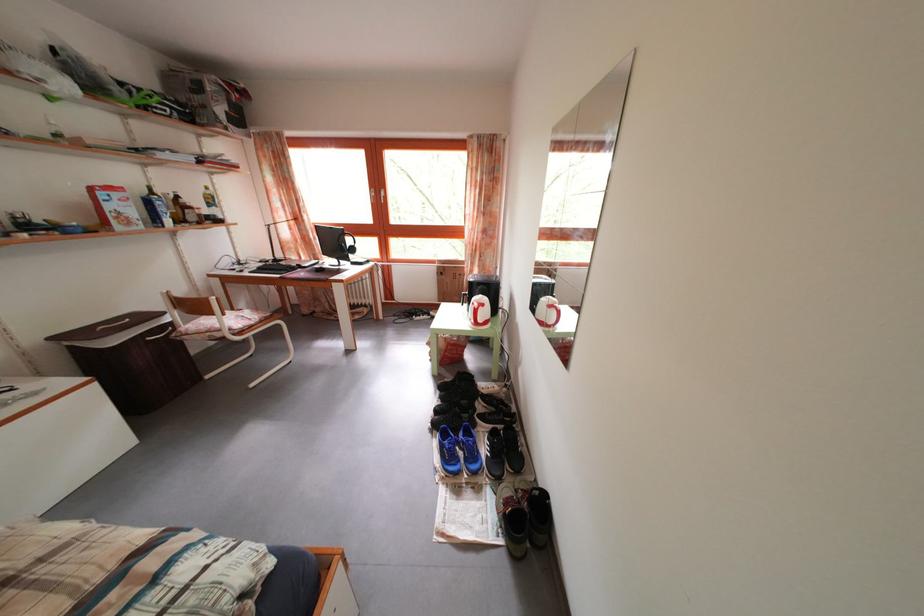
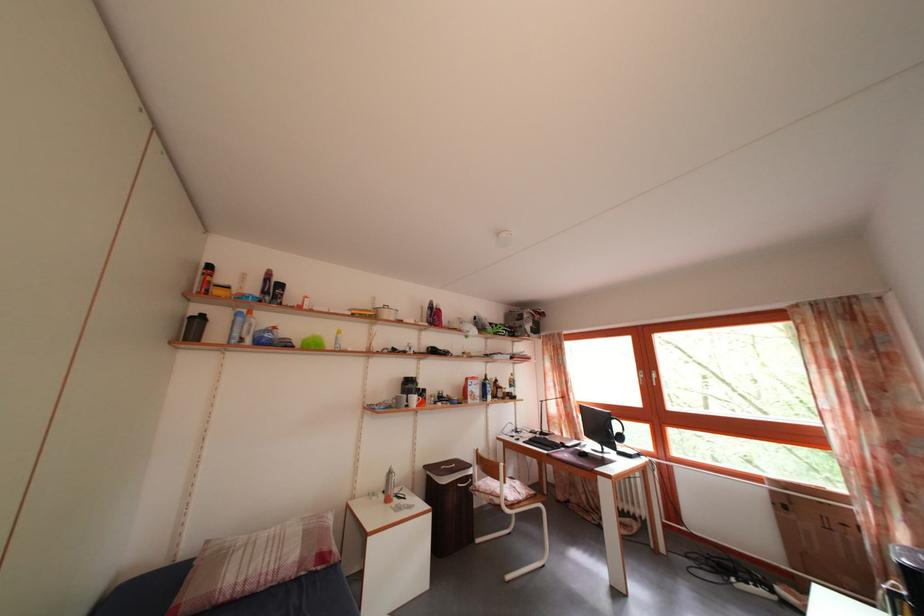
The point at (357, 248) is marked in the first image. Where is the corresponding point in the second image?

(624, 434)